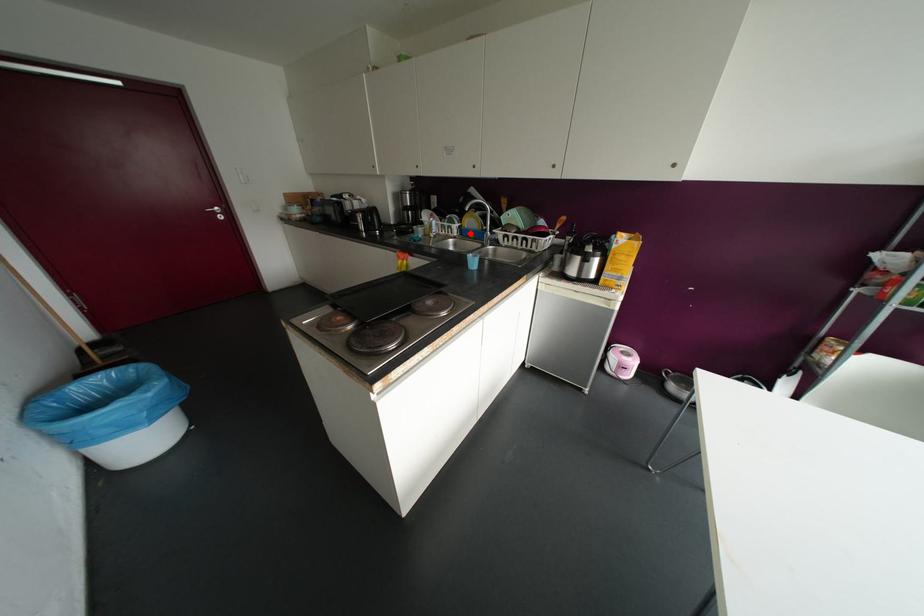
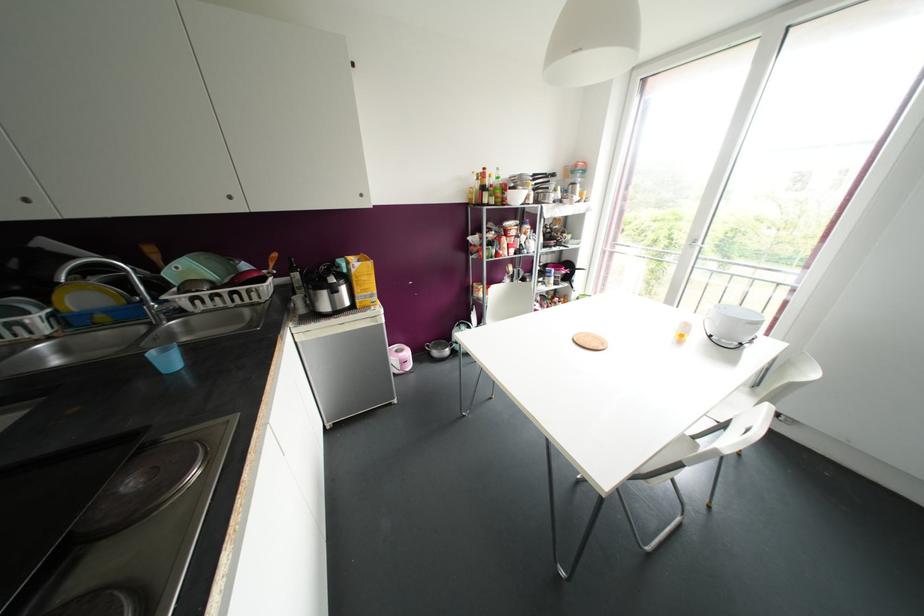
The point at the highlighted location is marked in the first image. Where is the corresponding point in the second image?

(101, 317)